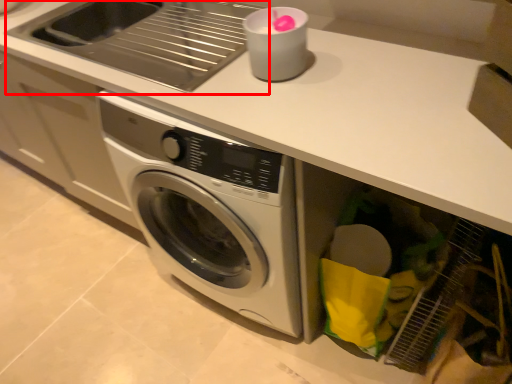
Question: From the image's perspective, what is the correct spatial positioning of sink (annotated by the red box) in reference to appliance?

Choices:
 (A) above
 (B) below

Answer: (A)